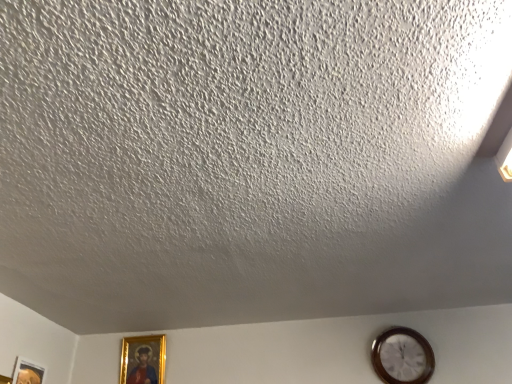
In order to face gold-framed picture at lower left, which appears as the 2th picture frame when viewed from the left, should I rotate leftwards or rightwards?

You should look left and rotate roughly 14.659 degrees.

At what (x,y) coordinates should I click in order to perform the action: click on wooden wall clock at lower right. Please return your answer as a coordinate pair (x, y). The image size is (512, 384). Looking at the image, I should click on (402, 357).

Is matte gold picture frame at lower left, the second picture frame when ordered from back to front, far away from wooden wall clock at lower right?

That's right, there is a large distance between matte gold picture frame at lower left, the second picture frame when ordered from back to front, and wooden wall clock at lower right.

Is matte gold picture frame at lower left, the second picture frame when ordered from right to left, turned away from wooden wall clock at lower right?

No, matte gold picture frame at lower left, the second picture frame when ordered from right to left, is not facing away from wooden wall clock at lower right.

Consider the image. Does matte gold picture frame at lower left, the second picture frame when ordered from right to left, have a greater height compared to wooden wall clock at lower right?

Correct, matte gold picture frame at lower left, the second picture frame when ordered from right to left, is much taller as wooden wall clock at lower right.

From a real-world perspective, who is located lower, gold-framed picture at lower left, which is the 2th picture frame in front-to-back order, or matte gold picture frame at lower left, which is the 1th picture frame in front-to-back order?

From a 3D spatial view, matte gold picture frame at lower left, which is the 1th picture frame in front-to-back order, is below.

Does gold-framed picture at lower left, marked as the first picture frame in a right-to-left arrangement, come in front of matte gold picture frame at lower left, which is the 1th picture frame in front-to-back order?

No, it is behind matte gold picture frame at lower left, which is the 1th picture frame in front-to-back order.

From the image's perspective, between gold-framed picture at lower left, which appears as the 2th picture frame when viewed from the left, and matte gold picture frame at lower left, the 1th picture frame in the left-to-right sequence, which one is located above?

From the image's view, matte gold picture frame at lower left, the 1th picture frame in the left-to-right sequence, is above.

This screenshot has width=512, height=384. I want to click on picture frame in front of the gold-framed picture at lower left, the first picture frame viewed from the back, so click(x=28, y=372).

The image size is (512, 384). Find the location of `picture frame above the matte gold picture frame at lower left, the second picture frame when ordered from right to left (from a real-world perspective)`. picture frame above the matte gold picture frame at lower left, the second picture frame when ordered from right to left (from a real-world perspective) is located at coordinates (143, 360).

Considering the sizes of objects matte gold picture frame at lower left, which is the 1th picture frame in front-to-back order, and gold-framed picture at lower left, which is the 2th picture frame in front-to-back order, in the image provided, who is smaller, matte gold picture frame at lower left, which is the 1th picture frame in front-to-back order, or gold-framed picture at lower left, which is the 2th picture frame in front-to-back order,?

matte gold picture frame at lower left, which is the 1th picture frame in front-to-back order, is smaller.

From the image's perspective, which one is positioned lower, matte gold picture frame at lower left, the 1th picture frame in the left-to-right sequence, or gold-framed picture at lower left, the first picture frame viewed from the back?

From the image's view, gold-framed picture at lower left, the first picture frame viewed from the back, is below.

How different are the orientations of matte gold picture frame at lower left, the second picture frame when ordered from back to front, and gold-framed picture at lower left, which is the 2th picture frame in front-to-back order, in degrees?

87.7 degrees separate the facing orientations of matte gold picture frame at lower left, the second picture frame when ordered from back to front, and gold-framed picture at lower left, which is the 2th picture frame in front-to-back order.

From a real-world perspective, is wooden wall clock at lower right located higher than gold-framed picture at lower left, marked as the first picture frame in a right-to-left arrangement?

Actually, wooden wall clock at lower right is physically below gold-framed picture at lower left, marked as the first picture frame in a right-to-left arrangement, in the real world.

Does point (386, 376) appear closer or farther from the camera than point (162, 380)?

Point (386, 376) is positioned closer to the camera compared to point (162, 380).

Considering the sizes of wooden wall clock at lower right and gold-framed picture at lower left, marked as the first picture frame in a right-to-left arrangement, in the image, is wooden wall clock at lower right taller or shorter than gold-framed picture at lower left, marked as the first picture frame in a right-to-left arrangement,?

In the image, wooden wall clock at lower right appears to be shorter than gold-framed picture at lower left, marked as the first picture frame in a right-to-left arrangement.

This screenshot has width=512, height=384. Find the location of `wall clock located underneath the gold-framed picture at lower left, marked as the first picture frame in a right-to-left arrangement (from a real-world perspective)`. wall clock located underneath the gold-framed picture at lower left, marked as the first picture frame in a right-to-left arrangement (from a real-world perspective) is located at coordinates (402, 357).

This screenshot has width=512, height=384. Find the location of `wall clock on the right of matte gold picture frame at lower left, the second picture frame when ordered from back to front`. wall clock on the right of matte gold picture frame at lower left, the second picture frame when ordered from back to front is located at coordinates (402, 357).

From the image's perspective, is wooden wall clock at lower right above matte gold picture frame at lower left, the 1th picture frame in the left-to-right sequence?

Correct, wooden wall clock at lower right appears higher than matte gold picture frame at lower left, the 1th picture frame in the left-to-right sequence, in the image.

Looking at the image, does wooden wall clock at lower right seem bigger or smaller compared to matte gold picture frame at lower left, the second picture frame when ordered from right to left?

Considering their sizes, wooden wall clock at lower right takes up more space than matte gold picture frame at lower left, the second picture frame when ordered from right to left.

Which object is positioned more to the left, wooden wall clock at lower right or matte gold picture frame at lower left, which is the 1th picture frame in front-to-back order?

Positioned to the left is matte gold picture frame at lower left, which is the 1th picture frame in front-to-back order.

From the image's perspective, does gold-framed picture at lower left, the first picture frame viewed from the back, appear higher than wooden wall clock at lower right?

No, from the image's perspective, gold-framed picture at lower left, the first picture frame viewed from the back, is not above wooden wall clock at lower right.

Is point (154, 356) more distant than point (396, 363)?

Yes.

Is the depth of gold-framed picture at lower left, the first picture frame viewed from the back, less than that of wooden wall clock at lower right?

No.

In the scene shown: Is gold-framed picture at lower left, the first picture frame viewed from the back, thinner than wooden wall clock at lower right?

Correct, the width of gold-framed picture at lower left, the first picture frame viewed from the back, is less than that of wooden wall clock at lower right.

Find the location of a particular element. The height and width of the screenshot is (384, 512). wall clock above the matte gold picture frame at lower left, the second picture frame when ordered from back to front (from a real-world perspective) is located at coordinates [402, 357].

Where is `picture frame that appears in front of the gold-framed picture at lower left, which appears as the 2th picture frame when viewed from the left`? picture frame that appears in front of the gold-framed picture at lower left, which appears as the 2th picture frame when viewed from the left is located at coordinates (28, 372).

When comparing their distances from wooden wall clock at lower right, does gold-framed picture at lower left, the first picture frame viewed from the back, or matte gold picture frame at lower left, the second picture frame when ordered from right to left, seem closer?

The object closer to wooden wall clock at lower right is gold-framed picture at lower left, the first picture frame viewed from the back.

Estimate the real-world distances between objects in this image. Which object is further from gold-framed picture at lower left, marked as the first picture frame in a right-to-left arrangement, matte gold picture frame at lower left, which is the 1th picture frame in front-to-back order, or wooden wall clock at lower right?

wooden wall clock at lower right is positioned further to the anchor gold-framed picture at lower left, marked as the first picture frame in a right-to-left arrangement.

Looking at the image, which one is located further to matte gold picture frame at lower left, the second picture frame when ordered from back to front, gold-framed picture at lower left, which appears as the 2th picture frame when viewed from the left, or wooden wall clock at lower right?

wooden wall clock at lower right lies further to matte gold picture frame at lower left, the second picture frame when ordered from back to front, than the other object.

Based on their spatial positions, is matte gold picture frame at lower left, the 1th picture frame in the left-to-right sequence, or gold-framed picture at lower left, which is the 2th picture frame in front-to-back order, closer to wooden wall clock at lower right?

gold-framed picture at lower left, which is the 2th picture frame in front-to-back order, is closer to wooden wall clock at lower right.

Considering their positions, is wooden wall clock at lower right positioned further to gold-framed picture at lower left, the first picture frame viewed from the back, than matte gold picture frame at lower left, which is the 1th picture frame in front-to-back order?

wooden wall clock at lower right lies further to gold-framed picture at lower left, the first picture frame viewed from the back, than the other object.

From the image, which object appears to be nearer to matte gold picture frame at lower left, the second picture frame when ordered from back to front, wooden wall clock at lower right or gold-framed picture at lower left, which appears as the 2th picture frame when viewed from the left?

gold-framed picture at lower left, which appears as the 2th picture frame when viewed from the left, lies closer to matte gold picture frame at lower left, the second picture frame when ordered from back to front, than the other object.

In order to click on picture frame between matte gold picture frame at lower left, the 1th picture frame in the left-to-right sequence, and wooden wall clock at lower right, in the horizontal direction in this screenshot , I will do `click(143, 360)`.